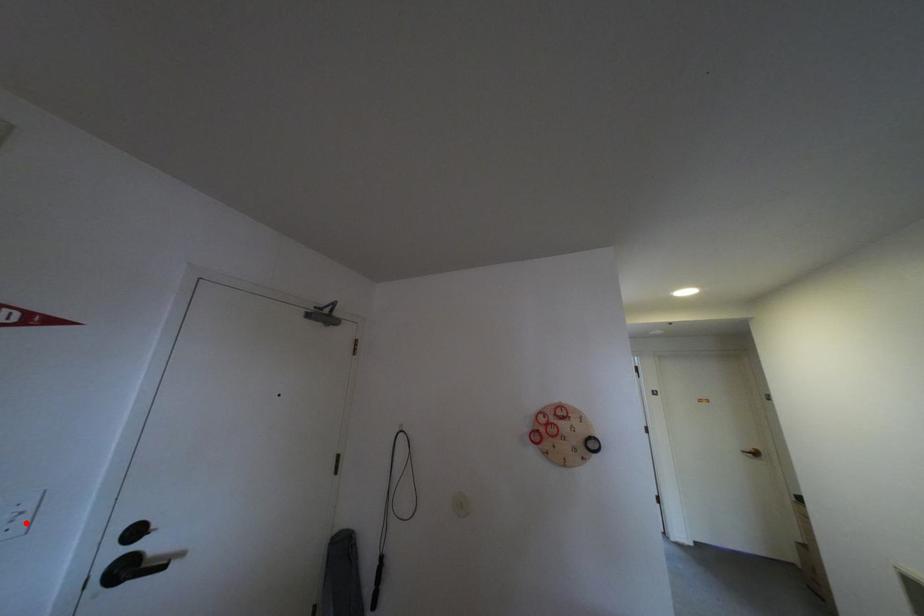
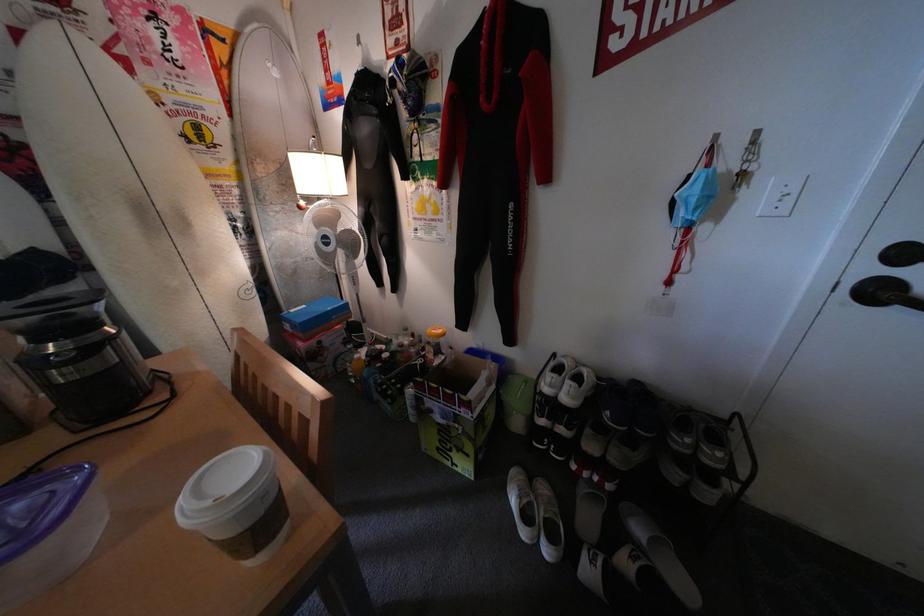
Question: I am providing you with two images of the same scene from different viewpoints. In image1, a red point is highlighted. Considering the same 3D point in image2, which of the following is correct?

Choices:
 (A) It is closer
 (B) It is farther

Answer: (B)